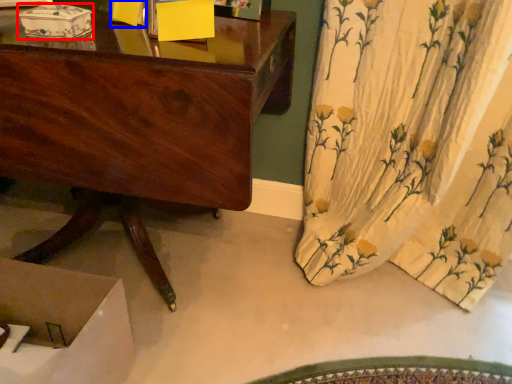
Question: Which of the following is the farthest to the observer, box (highlighted by a red box) or box (highlighted by a blue box)?

Choices:
 (A) box
 (B) box

Answer: (B)